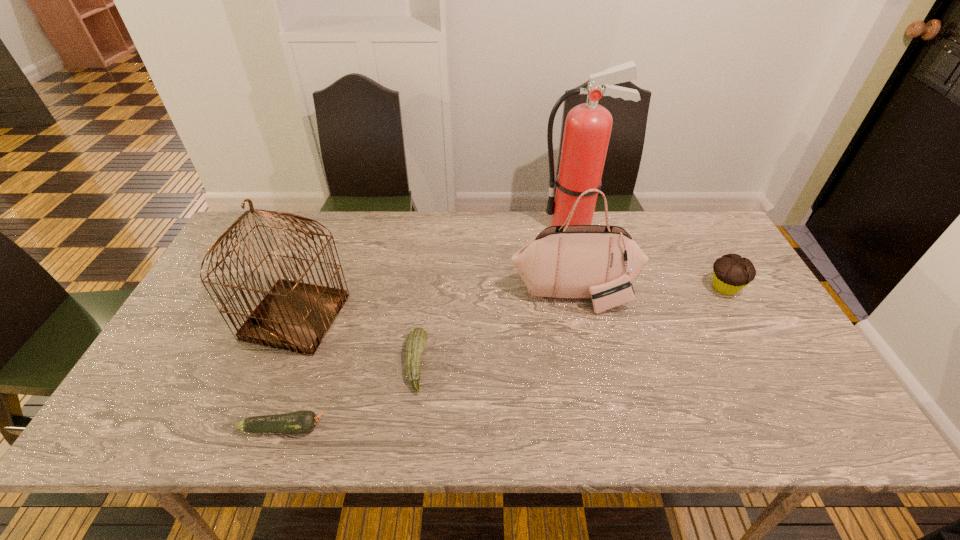
You are a GUI agent. You are given a task and a screenshot of the screen. Output one action in this format:
    pyautogui.click(x=<x>, y=<y>)
    Task: Click on the vacant space situated 0.090m on the hose direction of the tallest object
    
    Given the screenshot: What is the action you would take?
    pyautogui.click(x=511, y=225)

The image size is (960, 540). I want to click on vacant space located 0.210m on the hose direction of the tallest object, so click(474, 225).

Find the location of a particular element. The image size is (960, 540). free region located on the hose direction of the tallest object is located at coordinates (421, 225).

I want to click on free region located 0.190m on the back of the birdcage, so click(325, 242).

Image resolution: width=960 pixels, height=540 pixels. In order to click on vacant region located on the side of the handbag with the attached pouch in this screenshot , I will do `click(592, 378)`.

What are the coordinates of `vacant space located on the front of the muffin` in the screenshot? It's located at (783, 393).

I want to click on vacant space situated 0.260m at the stem end of the right zucchini, so click(x=532, y=363).

Locate an element on the screen. free space located at the blossom end of the left zucchini is located at coordinates (399, 428).

You are a GUI agent. You are given a task and a screenshot of the screen. Output one action in this format:
    pyautogui.click(x=<x>, y=<y>)
    Task: Click on the object that is at the far edge
    The height and width of the screenshot is (540, 960).
    Given the screenshot: What is the action you would take?
    pyautogui.click(x=588, y=126)

You are a GUI agent. You are given a task and a screenshot of the screen. Output one action in this format:
    pyautogui.click(x=<x>, y=<y>)
    Task: Click on the object present at the near edge
    
    Given the screenshot: What is the action you would take?
    pyautogui.click(x=299, y=422)